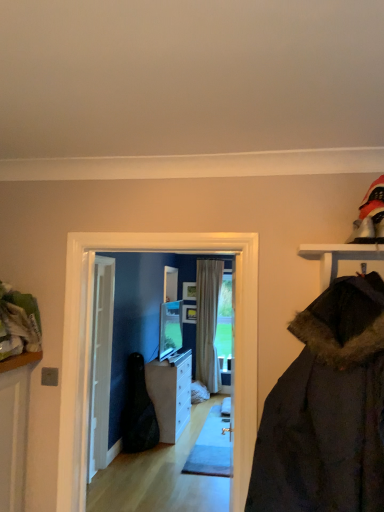
What are the coordinates of `beige fabric curtain at center` in the screenshot? It's located at (208, 322).

The width and height of the screenshot is (384, 512). Describe the element at coordinates (170, 396) in the screenshot. I see `white glossy cabinet at center` at that location.

What do you see at coordinates (101, 364) in the screenshot?
I see `white wooden door at center` at bounding box center [101, 364].

What do you see at coordinates (90, 347) in the screenshot?
I see `matte glass screen door at center` at bounding box center [90, 347].

Identify the location of matte glass screen door at center. coord(90,347).

You are a GUI agent. You are given a task and a screenshot of the screen. Output one action in this format:
    pyautogui.click(x=<x>, y=<y>)
    Task: Click on the black leather guitar case at center
    Image resolution: width=384 pixels, height=512 pixels.
    Given the screenshot: What is the action you would take?
    pyautogui.click(x=138, y=410)

The width and height of the screenshot is (384, 512). I want to click on beige fabric curtain at center, so click(208, 322).

In order to click on door behind the matte glass screen door at center in this screenshot , I will do `click(101, 364)`.

From a real-world perspective, is matte glass screen door at center physically below white wooden door at center?

Incorrect, from a real-world perspective, matte glass screen door at center is higher than white wooden door at center.

Between matte glass screen door at center and white wooden door at center, which one has smaller size?

white wooden door at center is smaller.

Can you confirm if matte glass screen door at center is wider than black leather guitar case at center?

In fact, matte glass screen door at center might be narrower than black leather guitar case at center.

Image resolution: width=384 pixels, height=512 pixels. Identify the location of screen door on the right of the black leather guitar case at center. (90, 347).

Is matte glass screen door at center looking in the opposite direction of black leather guitar case at center?

Yes.

Is black leather guitar case at center inside matte glass screen door at center?

Actually, black leather guitar case at center is outside matte glass screen door at center.

From the image's perspective, is beige fabric curtain at center above white glossy cabinet at center?

Yes.

Are beige fabric curtain at center and white glossy cabinet at center far apart?

That's right, there is a large distance between beige fabric curtain at center and white glossy cabinet at center.

Between beige fabric curtain at center and white glossy cabinet at center, which one has smaller width?

Thinner between the two is beige fabric curtain at center.

Measure the distance from beige fabric curtain at center to white glossy cabinet at center.

They are 3.57 feet apart.

Considering the sizes of beige fabric curtain at center and black leather guitar case at center in the image, is beige fabric curtain at center bigger or smaller than black leather guitar case at center?

In the image, beige fabric curtain at center appears to be larger than black leather guitar case at center.

Is beige fabric curtain at center not within black leather guitar case at center?

Absolutely, beige fabric curtain at center is external to black leather guitar case at center.

Find the location of a particular element. Image resolution: width=384 pixels, height=512 pixels. garment below the beige fabric curtain at center (from the image's perspective) is located at coordinates (138, 410).

From the image's perspective, who appears lower, beige fabric curtain at center or black leather guitar case at center?

black leather guitar case at center appears lower in the image.

Looking at this image, can you confirm if white wooden door at center is positioned to the right of black leather guitar case at center?

In fact, white wooden door at center is to the left of black leather guitar case at center.

Can you see white wooden door at center touching black leather guitar case at center?

No, white wooden door at center is not making contact with black leather guitar case at center.

From the image's perspective, is white wooden door at center located above or below black leather guitar case at center?

Clearly, from the image's perspective, white wooden door at center is above black leather guitar case at center.

Which is in front, point (104, 280) or point (123, 436)?

The point (104, 280) is more forward.

Can you confirm if white glossy cabinet at center is smaller than black leather guitar case at center?

Incorrect, white glossy cabinet at center is not smaller in size than black leather guitar case at center.

Consider the image. Is white glossy cabinet at center next to black leather guitar case at center and touching it?

No, white glossy cabinet at center is not beside black leather guitar case at center.

Between point (182, 423) and point (129, 414), which one is positioned in front?

The point (129, 414) is more forward.

Is point (236, 270) in front of point (202, 347)?

Yes.

Considering the sizes of objects matte glass screen door at center and beige fabric curtain at center in the image provided, who is smaller, matte glass screen door at center or beige fabric curtain at center?

matte glass screen door at center is smaller.

Considering the relative positions of matte glass screen door at center and beige fabric curtain at center in the image provided, is matte glass screen door at center behind beige fabric curtain at center?

No, matte glass screen door at center is in front of beige fabric curtain at center.

Where is `door below the matte glass screen door at center (from a real-world perspective)`? door below the matte glass screen door at center (from a real-world perspective) is located at coordinates (101, 364).

The width and height of the screenshot is (384, 512). Find the location of `screen door above the black leather guitar case at center (from the image's perspective)`. screen door above the black leather guitar case at center (from the image's perspective) is located at coordinates tap(90, 347).

Based on their spatial positions, is white wooden door at center or black leather guitar case at center further from matte glass screen door at center?

black leather guitar case at center is further to matte glass screen door at center.

When comparing their distances from black leather guitar case at center, does white wooden door at center or beige fabric curtain at center seem further?

The object further to black leather guitar case at center is beige fabric curtain at center.

When comparing their distances from matte glass screen door at center, does black leather guitar case at center or white glossy cabinet at center seem further?

white glossy cabinet at center is positioned further to the anchor matte glass screen door at center.

Based on their spatial positions, is beige fabric curtain at center or black leather guitar case at center further from white wooden door at center?

The object further to white wooden door at center is beige fabric curtain at center.

From the image, which object appears to be nearer to black leather guitar case at center, white glossy cabinet at center or matte glass screen door at center?

Among the two, white glossy cabinet at center is located nearer to black leather guitar case at center.

Estimate the real-world distances between objects in this image. Which object is further from black leather guitar case at center, white glossy cabinet at center or beige fabric curtain at center?

Among the two, beige fabric curtain at center is located further to black leather guitar case at center.

Considering their positions, is beige fabric curtain at center positioned closer to white wooden door at center than white glossy cabinet at center?

white glossy cabinet at center lies closer to white wooden door at center than the other object.

When comparing their distances from matte glass screen door at center, does beige fabric curtain at center or black leather guitar case at center seem closer?

black leather guitar case at center is closer to matte glass screen door at center.

At what (x,y) coordinates should I click in order to perform the action: click on door between matte glass screen door at center and white glossy cabinet at center from front to back. Please return your answer as a coordinate pair (x, y). The width and height of the screenshot is (384, 512). Looking at the image, I should click on (101, 364).

Where is `door positioned between matte glass screen door at center and beige fabric curtain at center from near to far`? door positioned between matte glass screen door at center and beige fabric curtain at center from near to far is located at coordinates (101, 364).

Locate an element on the screen. This screenshot has height=512, width=384. cabinetry positioned between matte glass screen door at center and beige fabric curtain at center from near to far is located at coordinates (170, 396).

Where is `cabinetry located between black leather guitar case at center and beige fabric curtain at center in the depth direction`? This screenshot has width=384, height=512. cabinetry located between black leather guitar case at center and beige fabric curtain at center in the depth direction is located at coordinates (170, 396).